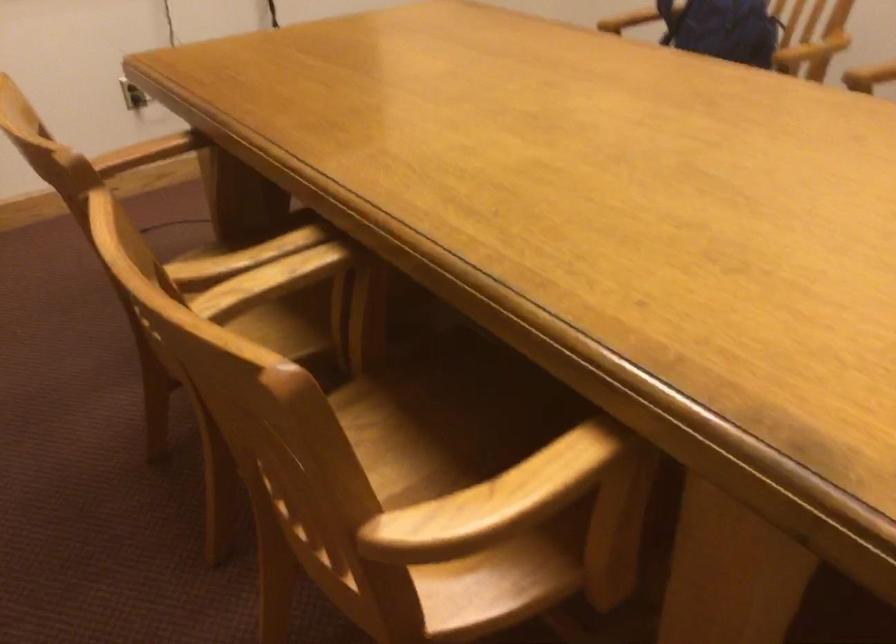
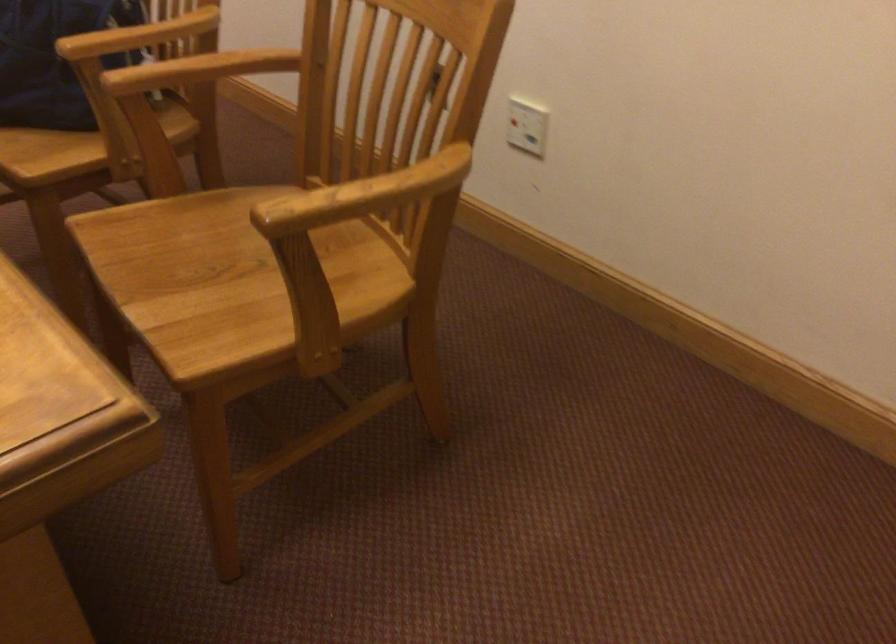
Question: What movement of the cameraman would produce the second image?

Choices:
 (A) Left
 (B) Right
 (C) Forward
 (D) Backward

Answer: (B)